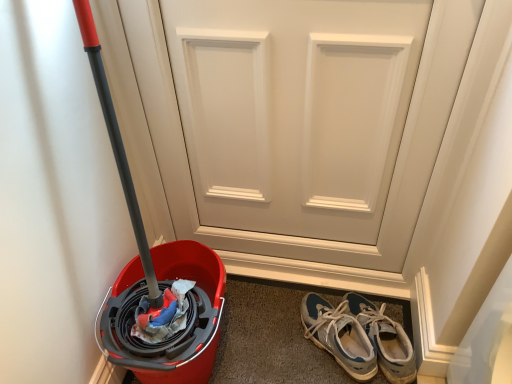
Locate an element on the screen. This screenshot has height=384, width=512. vacant space behind blue suede sneakers at lower right, the second footwear from the right is located at coordinates (310, 286).